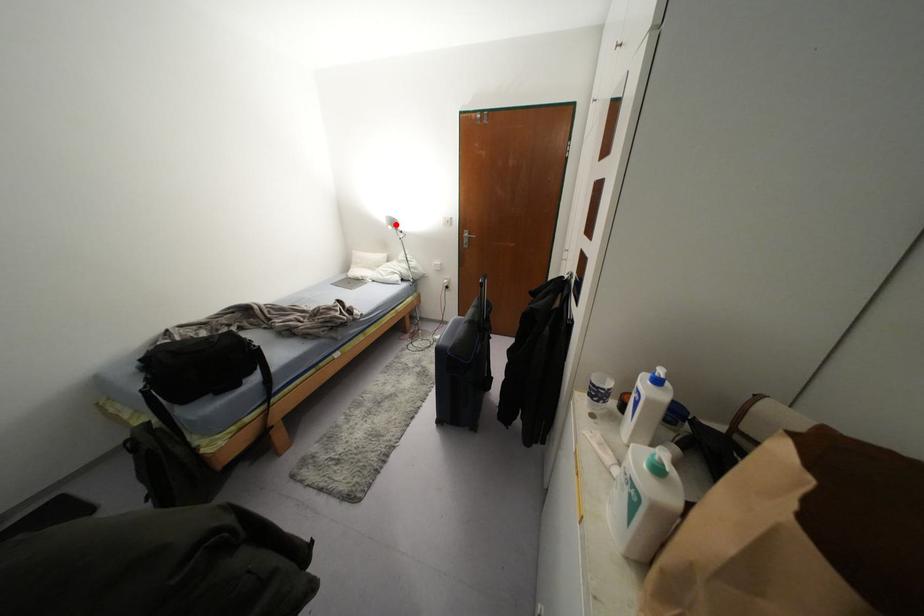
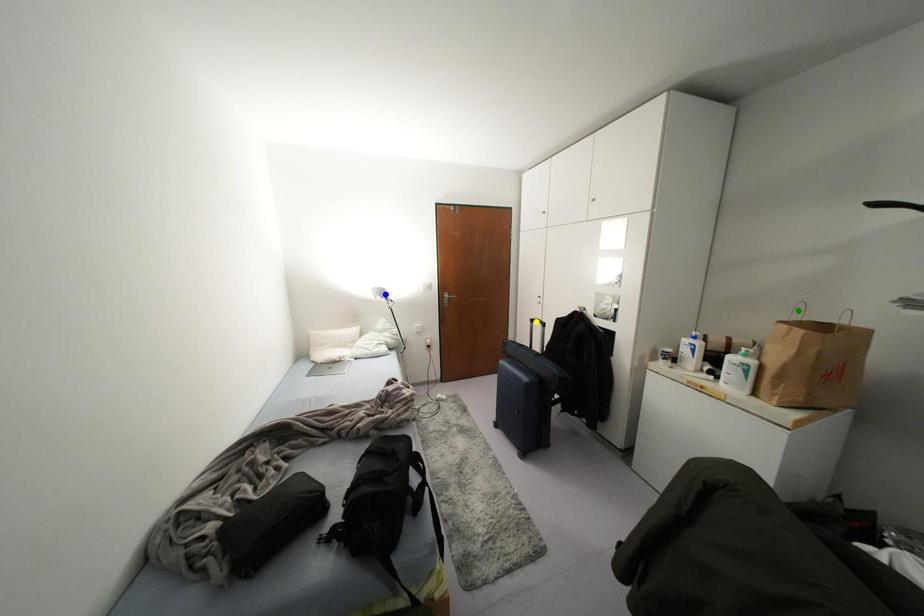
Question: I am providing you with two images of the same scene from different viewpoints. A red point is marked on the first image. You are given multiple points on the second image. Which spot in image 2 lines up with the point in image 1?

Choices:
 (A) blue point
 (B) yellow point
 (C) green point

Answer: (A)